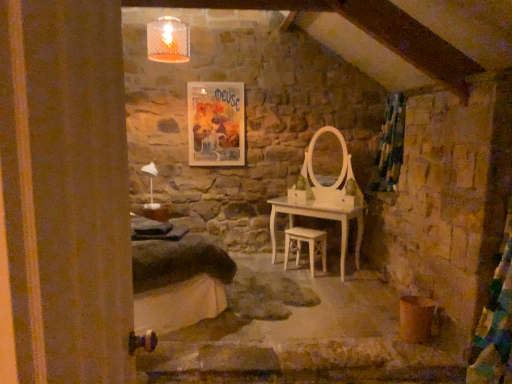
Question: Does green fabric curtain at right lie in front of white wooden stool at center?

Choices:
 (A) no
 (B) yes

Answer: (A)

Question: From the image's perspective, is green fabric curtain at right under white wooden stool at center?

Choices:
 (A) no
 (B) yes

Answer: (A)

Question: Is green fabric curtain at right turned away from white wooden stool at center?

Choices:
 (A) no
 (B) yes

Answer: (A)

Question: Is green fabric curtain at right to the right of white wooden stool at center from the viewer's perspective?

Choices:
 (A) yes
 (B) no

Answer: (A)

Question: Does green fabric curtain at right have a larger size compared to white wooden stool at center?

Choices:
 (A) yes
 (B) no

Answer: (A)

Question: Does green fabric curtain at right turn towards white wooden stool at center?

Choices:
 (A) no
 (B) yes

Answer: (A)

Question: Is matte paper poster at upper center at the back of green fabric curtain at right?

Choices:
 (A) yes
 (B) no

Answer: (B)

Question: Considering the relative positions of green fabric curtain at right and matte paper poster at upper center in the image provided, is green fabric curtain at right behind matte paper poster at upper center?

Choices:
 (A) no
 (B) yes

Answer: (A)

Question: Is green fabric curtain at right shorter than matte paper poster at upper center?

Choices:
 (A) no
 (B) yes

Answer: (A)

Question: From a real-world perspective, is green fabric curtain at right physically below matte paper poster at upper center?

Choices:
 (A) no
 (B) yes

Answer: (B)

Question: Is green fabric curtain at right touching matte paper poster at upper center?

Choices:
 (A) yes
 (B) no

Answer: (B)

Question: Can you confirm if green fabric curtain at right is bigger than matte paper poster at upper center?

Choices:
 (A) no
 (B) yes

Answer: (B)

Question: Is matte paper poster at upper center at the left side of green fabric curtain at right?

Choices:
 (A) yes
 (B) no

Answer: (A)